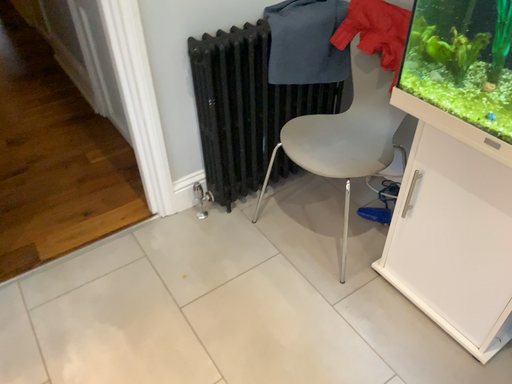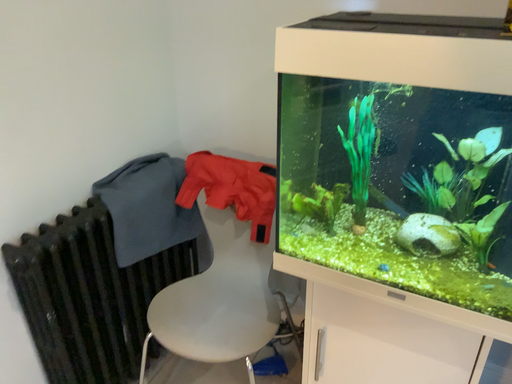
Question: Which way did the camera rotate in the video?

Choices:
 (A) rotated downward
 (B) rotated upward

Answer: (B)